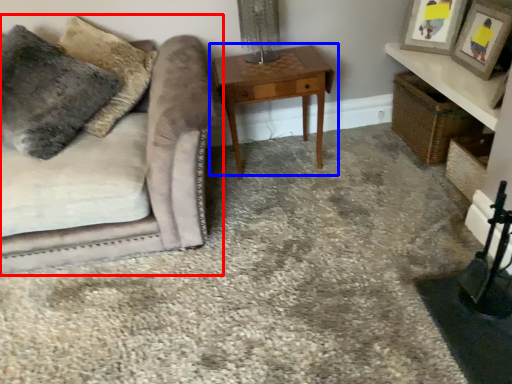
Question: Which object appears farthest to the camera in this image, studio couch (highlighted by a red box) or table (highlighted by a blue box)?

Choices:
 (A) studio couch
 (B) table

Answer: (B)